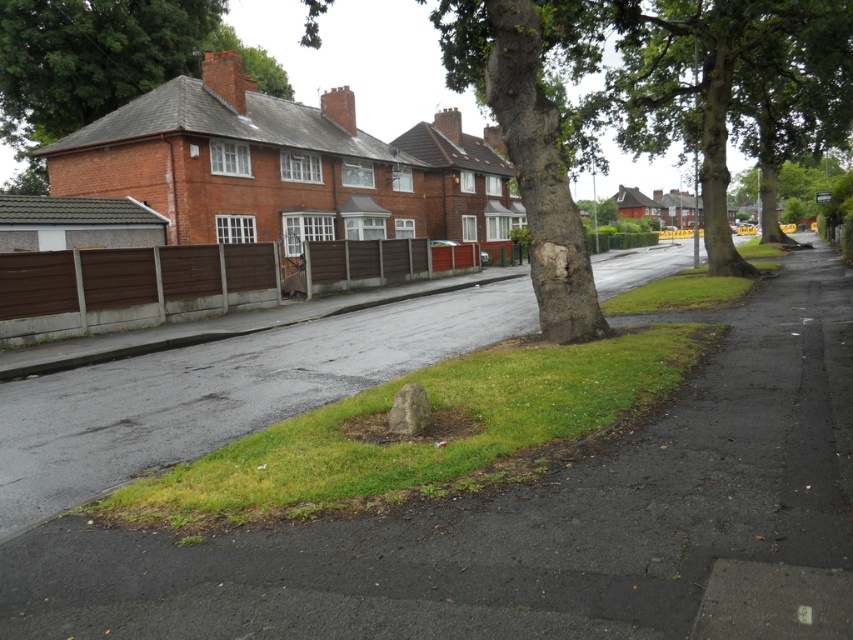
You are standing at the point where the stone is located. Which direction should you walk to reach the green leafy tree at center?

The green leafy tree at center is located at point (732, 90). Since the stone is near the tree roots, you are already close to the tree. You can walk towards the tree trunk in the direction of the center of the image.

Looking at this image, you are standing at the center of the residential street and want to avoid the wet pavement. The green leafy tree at center is in your way. Can you walk around it to reach the grassy area on the left side?

The green leafy tree at center is located at point (732, 90), so yes, you can walk around it to reach the grassy area on the left side since the tree is positioned centrally, allowing space to navigate around it towards the grass.

You are standing on the residential street and want to take a photo of both the green leafy tree at upper center and the green leafy tree at upper right. Which tree should you focus on first to ensure both are in the frame?

You should focus on the green leafy tree at upper right first because it is farther away from you than the green leafy tree at upper center, allowing both to be captured in the frame when adjusting the camera.